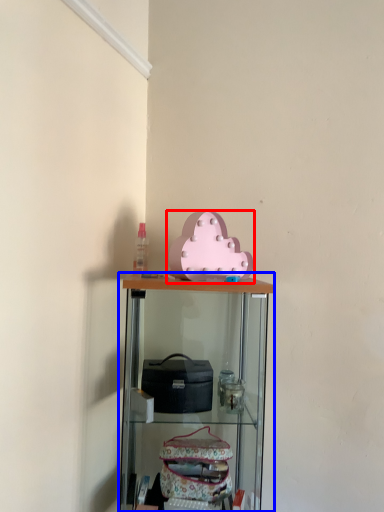
Question: Which point is closer to the camera, toy (highlighted by a red box) or shelf (highlighted by a blue box)?

Choices:
 (A) toy
 (B) shelf

Answer: (B)